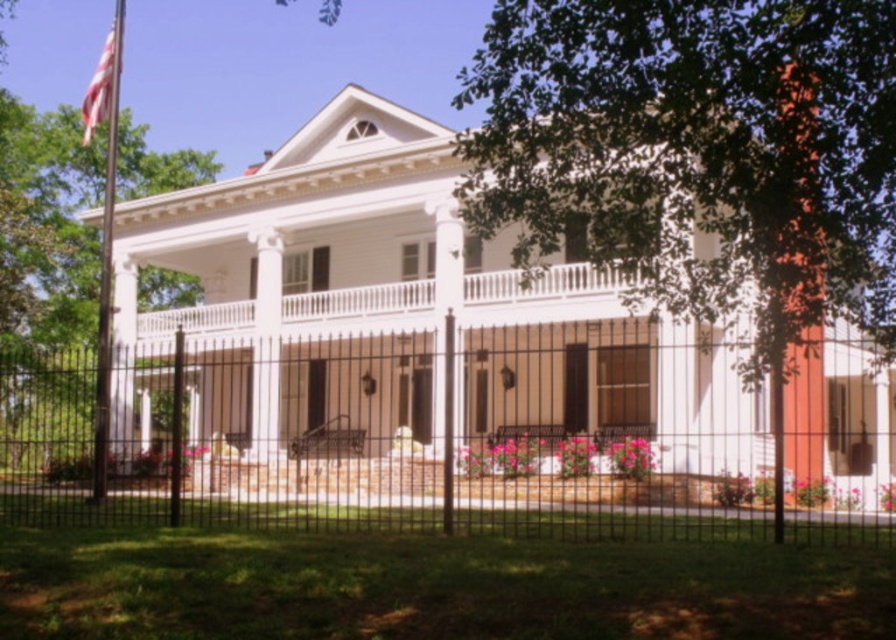
Question: Is metallic flag pole at left smaller than american flag at upper left?

Choices:
 (A) yes
 (B) no

Answer: (A)

Question: Which point appears closest to the camera in this image?

Choices:
 (A) (100, 58)
 (B) (115, 61)
 (C) (127, 358)

Answer: (B)

Question: Does black wrought iron fence at center have a smaller size compared to green leafy tree at upper right?

Choices:
 (A) yes
 (B) no

Answer: (A)

Question: Is black wrought iron fence at center bigger than green leafy tree at upper right?

Choices:
 (A) yes
 (B) no

Answer: (B)

Question: Which point is closer to the camera?

Choices:
 (A) (112, 148)
 (B) (850, 120)
 (C) (552, 524)
 (D) (115, 52)

Answer: (B)

Question: Considering the real-world distances, which object is farthest from the green leafy tree at upper right?

Choices:
 (A) american flag at upper left
 (B) metallic flag pole at left
 (C) black wrought iron fence at center

Answer: (A)